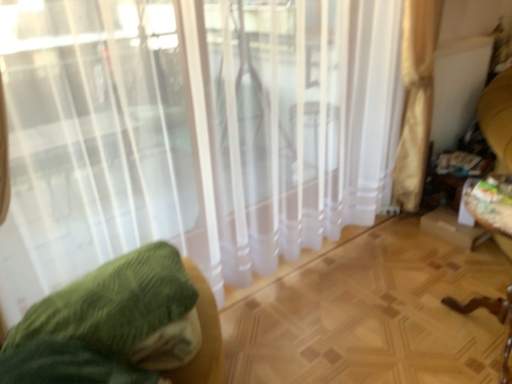
Question: Would you say white sheer curtain at center is outside green fabric cushion at left?

Choices:
 (A) yes
 (B) no

Answer: (A)

Question: Considering the relative sizes of white sheer curtain at center and green fabric cushion at left in the image provided, is white sheer curtain at center taller than green fabric cushion at left?

Choices:
 (A) no
 (B) yes

Answer: (B)

Question: From the image's perspective, is white sheer curtain at center above green fabric cushion at left?

Choices:
 (A) yes
 (B) no

Answer: (A)

Question: Does white sheer curtain at center have a greater width compared to green fabric cushion at left?

Choices:
 (A) yes
 (B) no

Answer: (B)

Question: Is white sheer curtain at center closer to the viewer compared to green fabric cushion at left?

Choices:
 (A) no
 (B) yes

Answer: (B)

Question: Looking at their shapes, would you say green fabric cushion at left is wider or thinner than white sheer curtain at center?

Choices:
 (A) thin
 (B) wide

Answer: (B)

Question: Is green fabric cushion at left inside or outside of white sheer curtain at center?

Choices:
 (A) inside
 (B) outside

Answer: (B)

Question: Is green fabric cushion at left in front of or behind white sheer curtain at center in the image?

Choices:
 (A) front
 (B) behind

Answer: (B)

Question: Considering the relative positions of green fabric cushion at left and white sheer curtain at center in the image provided, is green fabric cushion at left to the left or to the right of white sheer curtain at center?

Choices:
 (A) left
 (B) right

Answer: (A)

Question: Considering the positions of point (322, 84) and point (69, 317), is point (322, 84) closer or farther from the camera than point (69, 317)?

Choices:
 (A) farther
 (B) closer

Answer: (A)

Question: Relative to green fabric cushion at left, is white sheer curtain at center in front or behind?

Choices:
 (A) behind
 (B) front

Answer: (B)

Question: From a real-world perspective, is white sheer curtain at center positioned above or below green fabric cushion at left?

Choices:
 (A) below
 (B) above

Answer: (B)

Question: Considering the positions of white sheer curtain at center and green fabric cushion at left in the image, is white sheer curtain at center taller or shorter than green fabric cushion at left?

Choices:
 (A) tall
 (B) short

Answer: (A)

Question: In terms of width, does wooden swivel chair at right look wider or thinner when compared to green fabric cushion at left?

Choices:
 (A) thin
 (B) wide

Answer: (A)

Question: Does point (507, 213) appear closer or farther from the camera than point (114, 294)?

Choices:
 (A) closer
 (B) farther

Answer: (B)